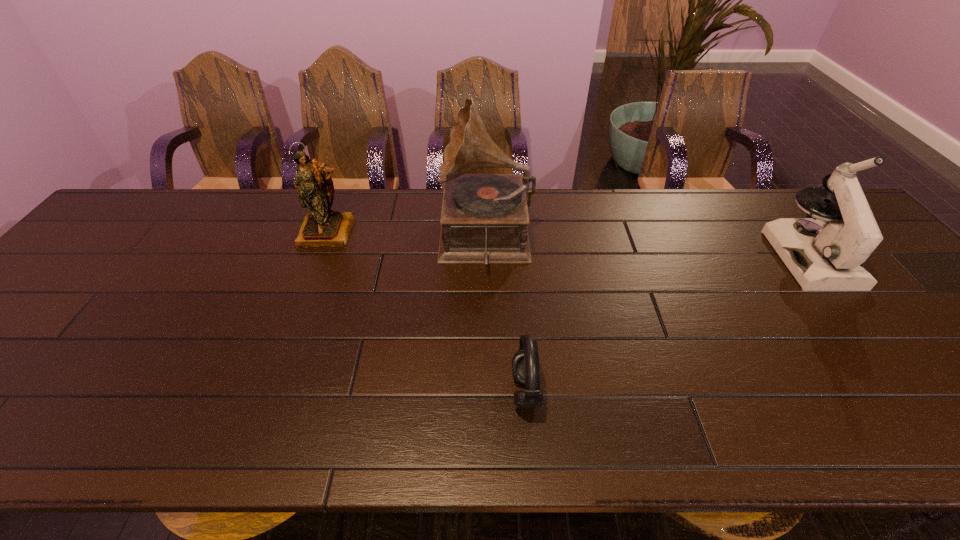
Identify the location of vacant area that lies between the nearest object and the leftmost object. (427, 312).

Where is `free space between the record player and the rightmost object`? free space between the record player and the rightmost object is located at coordinates (648, 248).

Locate an element on the screen. Image resolution: width=960 pixels, height=540 pixels. vacant space that is in between the microscope and the figurine is located at coordinates (569, 245).

Identify which object is located as the nearest to the figurine. Please provide its 2D coordinates. Your answer should be formatted as a tuple, i.e. [(x, y)], where the tuple contains the x and y coordinates of a point satisfying the conditions above.

[(484, 217)]

Locate which object is the closest to the nearest object. Please provide its 2D coordinates. Your answer should be formatted as a tuple, i.e. [(x, y)], where the tuple contains the x and y coordinates of a point satisfying the conditions above.

[(484, 217)]

Where is `vacant region that satisfies the following two spatial constraints: 1. at the eyepiece of the rightmost object; 2. on the earcups of the nearest object`? Image resolution: width=960 pixels, height=540 pixels. vacant region that satisfies the following two spatial constraints: 1. at the eyepiece of the rightmost object; 2. on the earcups of the nearest object is located at coordinates (916, 392).

Find the location of a particular element. This screenshot has height=540, width=960. vacant area that satisfies the following two spatial constraints: 1. at the eyepiece of the microscope; 2. on the earcups of the headset is located at coordinates (916, 392).

The image size is (960, 540). In order to click on vacant region that satisfies the following two spatial constraints: 1. at the eyepiece of the rightmost object; 2. on the earcups of the headset in this screenshot , I will do `click(916, 392)`.

I want to click on vacant space that satisfies the following two spatial constraints: 1. at the eyepiece of the microscope; 2. on the earcups of the headset, so click(916, 392).